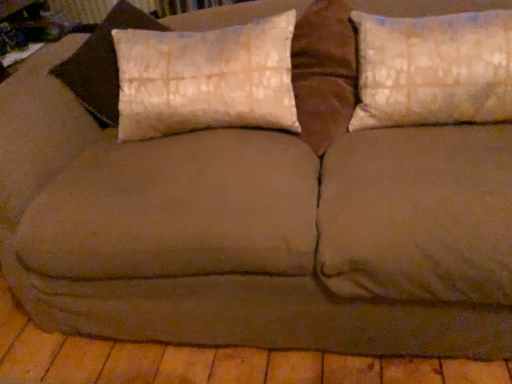
Image resolution: width=512 pixels, height=384 pixels. What do you see at coordinates (206, 79) in the screenshot? I see `white textured pillow at center, marked as the first pillow in a left-to-right arrangement` at bounding box center [206, 79].

Locate an element on the screen. white textured pillow at center, which ranks as the second pillow in right-to-left order is located at coordinates (206, 79).

What is the approximate width of white textured pillow at center, which ranks as the second pillow in right-to-left order?

The width of white textured pillow at center, which ranks as the second pillow in right-to-left order, is 13.09 inches.

The width and height of the screenshot is (512, 384). I want to click on textured beige pillow at upper right, which is the first pillow in right-to-left order, so click(433, 69).

This screenshot has width=512, height=384. What do you see at coordinates (433, 69) in the screenshot?
I see `textured beige pillow at upper right, arranged as the second pillow when viewed from the left` at bounding box center [433, 69].

Where is `white textured pillow at center, which ranks as the second pillow in right-to-left order`? white textured pillow at center, which ranks as the second pillow in right-to-left order is located at coordinates (206, 79).

Is white textured pillow at center, which ranks as the second pillow in right-to-left order, to the right of textured beige pillow at upper right, which is the first pillow in right-to-left order, from the viewer's perspective?

No, white textured pillow at center, which ranks as the second pillow in right-to-left order, is not to the right of textured beige pillow at upper right, which is the first pillow in right-to-left order.

Considering their positions, is white textured pillow at center, which ranks as the second pillow in right-to-left order, located in front of or behind textured beige pillow at upper right, arranged as the second pillow when viewed from the left?

white textured pillow at center, which ranks as the second pillow in right-to-left order, is behind textured beige pillow at upper right, arranged as the second pillow when viewed from the left.

Does point (173, 127) come in front of point (499, 90)?

That is False.

From the image's perspective, is white textured pillow at center, marked as the first pillow in a left-to-right arrangement, positioned above or below textured beige pillow at upper right, which is the first pillow in right-to-left order?

Based on their image positions, white textured pillow at center, marked as the first pillow in a left-to-right arrangement, is located beneath textured beige pillow at upper right, which is the first pillow in right-to-left order.

From a real-world perspective, who is located lower, white textured pillow at center, marked as the first pillow in a left-to-right arrangement, or textured beige pillow at upper right, which is the first pillow in right-to-left order?

textured beige pillow at upper right, which is the first pillow in right-to-left order.

Between white textured pillow at center, which ranks as the second pillow in right-to-left order, and textured beige pillow at upper right, arranged as the second pillow when viewed from the left, which one has smaller width?

textured beige pillow at upper right, arranged as the second pillow when viewed from the left.

Does white textured pillow at center, which ranks as the second pillow in right-to-left order, have a lesser height compared to textured beige pillow at upper right, which is the first pillow in right-to-left order?

Yes, white textured pillow at center, which ranks as the second pillow in right-to-left order, is shorter than textured beige pillow at upper right, which is the first pillow in right-to-left order.

In terms of size, does white textured pillow at center, marked as the first pillow in a left-to-right arrangement, appear bigger or smaller than textured beige pillow at upper right, which is the first pillow in right-to-left order?

white textured pillow at center, marked as the first pillow in a left-to-right arrangement, is bigger than textured beige pillow at upper right, which is the first pillow in right-to-left order.

Is white textured pillow at center, which ranks as the second pillow in right-to-left order, not within textured beige pillow at upper right, arranged as the second pillow when viewed from the left?

Yes.

Consider the image. Is there a large distance between white textured pillow at center, which ranks as the second pillow in right-to-left order, and textured beige pillow at upper right, which is the first pillow in right-to-left order?

white textured pillow at center, which ranks as the second pillow in right-to-left order, is near textured beige pillow at upper right, which is the first pillow in right-to-left order, not far away.

Is white textured pillow at center, which ranks as the second pillow in right-to-left order, facing towards textured beige pillow at upper right, which is the first pillow in right-to-left order?

No, white textured pillow at center, which ranks as the second pillow in right-to-left order, is not aimed at textured beige pillow at upper right, which is the first pillow in right-to-left order.

Can you tell me how much white textured pillow at center, which ranks as the second pillow in right-to-left order, and textured beige pillow at upper right, which is the first pillow in right-to-left order, differ in facing direction?

The angular difference between white textured pillow at center, which ranks as the second pillow in right-to-left order, and textured beige pillow at upper right, which is the first pillow in right-to-left order, is 0.000125 degrees.

Could you measure the distance between white textured pillow at center, marked as the first pillow in a left-to-right arrangement, and textured beige pillow at upper right, arranged as the second pillow when viewed from the left?

white textured pillow at center, marked as the first pillow in a left-to-right arrangement, is 16.86 inches from textured beige pillow at upper right, arranged as the second pillow when viewed from the left.

Image resolution: width=512 pixels, height=384 pixels. In the image, there is a white textured pillow at center, marked as the first pillow in a left-to-right arrangement. Identify the location of pillow above it (from the image's perspective). (433, 69).

Which is more to the right, textured beige pillow at upper right, arranged as the second pillow when viewed from the left, or white textured pillow at center, which ranks as the second pillow in right-to-left order?

textured beige pillow at upper right, arranged as the second pillow when viewed from the left, is more to the right.

Is textured beige pillow at upper right, arranged as the second pillow when viewed from the left, closer to camera compared to white textured pillow at center, which ranks as the second pillow in right-to-left order?

Yes, textured beige pillow at upper right, arranged as the second pillow when viewed from the left, is closer to the viewer.

Considering the points (359, 67) and (118, 35), which point is in front, point (359, 67) or point (118, 35)?

The point (359, 67) is closer to the camera.

From the image's perspective, is textured beige pillow at upper right, arranged as the second pillow when viewed from the left, beneath white textured pillow at center, marked as the first pillow in a left-to-right arrangement?

Incorrect, from the image's perspective, textured beige pillow at upper right, arranged as the second pillow when viewed from the left, is higher than white textured pillow at center, marked as the first pillow in a left-to-right arrangement.

From a real-world perspective, between textured beige pillow at upper right, arranged as the second pillow when viewed from the left, and white textured pillow at center, marked as the first pillow in a left-to-right arrangement, who is vertically lower?

In real-world perspective, textured beige pillow at upper right, arranged as the second pillow when viewed from the left, is lower.

In terms of width, does textured beige pillow at upper right, which is the first pillow in right-to-left order, look wider or thinner when compared to white textured pillow at center, marked as the first pillow in a left-to-right arrangement?

textured beige pillow at upper right, which is the first pillow in right-to-left order, is thinner than white textured pillow at center, marked as the first pillow in a left-to-right arrangement.

Considering the relative sizes of textured beige pillow at upper right, arranged as the second pillow when viewed from the left, and white textured pillow at center, which ranks as the second pillow in right-to-left order, in the image provided, is textured beige pillow at upper right, arranged as the second pillow when viewed from the left, shorter than white textured pillow at center, which ranks as the second pillow in right-to-left order,?

Incorrect, the height of textured beige pillow at upper right, arranged as the second pillow when viewed from the left, does not fall short of that of white textured pillow at center, which ranks as the second pillow in right-to-left order.

In the scene shown: Which of these two, textured beige pillow at upper right, arranged as the second pillow when viewed from the left, or white textured pillow at center, marked as the first pillow in a left-to-right arrangement, is bigger?

white textured pillow at center, marked as the first pillow in a left-to-right arrangement, is bigger.

Is textured beige pillow at upper right, arranged as the second pillow when viewed from the left, inside or outside of white textured pillow at center, marked as the first pillow in a left-to-right arrangement?

The correct answer is: outside.

Are textured beige pillow at upper right, which is the first pillow in right-to-left order, and white textured pillow at center, marked as the first pillow in a left-to-right arrangement, far apart?

No, textured beige pillow at upper right, which is the first pillow in right-to-left order, is not far away from white textured pillow at center, marked as the first pillow in a left-to-right arrangement.

Is textured beige pillow at upper right, which is the first pillow in right-to-left order, positioned with its back to white textured pillow at center, marked as the first pillow in a left-to-right arrangement?

No, textured beige pillow at upper right, which is the first pillow in right-to-left order, is not facing the opposite direction of white textured pillow at center, marked as the first pillow in a left-to-right arrangement.

Can you tell me how much textured beige pillow at upper right, which is the first pillow in right-to-left order, and white textured pillow at center, which ranks as the second pillow in right-to-left order, differ in facing direction?

0.000125 degrees separate the facing orientations of textured beige pillow at upper right, which is the first pillow in right-to-left order, and white textured pillow at center, which ranks as the second pillow in right-to-left order.

How far apart are textured beige pillow at upper right, which is the first pillow in right-to-left order, and white textured pillow at center, marked as the first pillow in a left-to-right arrangement?

They are 42.83 centimeters apart.

What are the coordinates of `pillow on the left of textured beige pillow at upper right, which is the first pillow in right-to-left order` in the screenshot? It's located at (206, 79).

Locate an element on the screen. pillow below the white textured pillow at center, marked as the first pillow in a left-to-right arrangement (from a real-world perspective) is located at coordinates (433, 69).

Identify the location of pillow located above the white textured pillow at center, which ranks as the second pillow in right-to-left order (from the image's perspective). (433, 69).